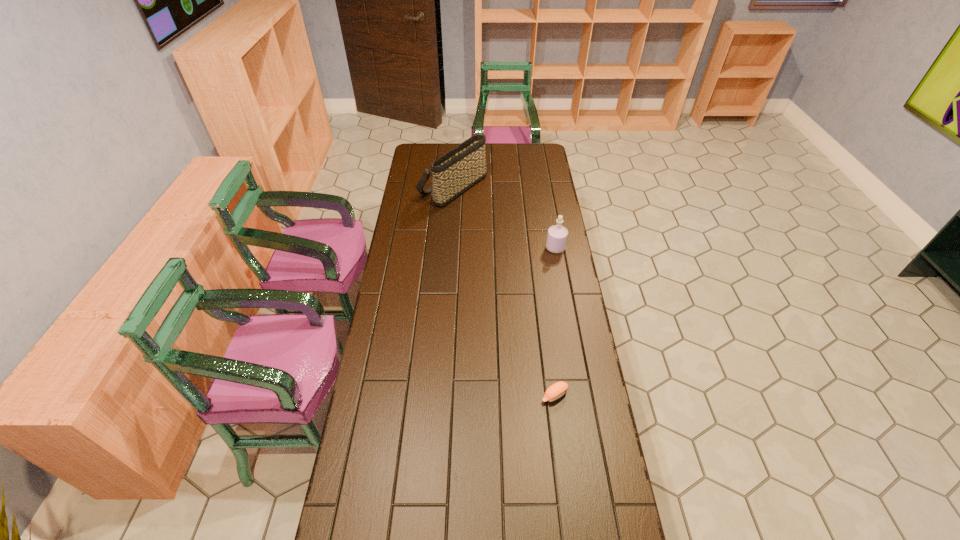
At what (x,y) coordinates should I click in order to perform the action: click on handbag. Please return your answer as a coordinate pair (x, y). The image size is (960, 540). Looking at the image, I should click on (456, 171).

Identify the location of the leftmost object. Image resolution: width=960 pixels, height=540 pixels. (456, 171).

The height and width of the screenshot is (540, 960). I want to click on the second shortest object, so click(557, 235).

What are the coordinates of `perfume` in the screenshot? It's located at (557, 235).

This screenshot has width=960, height=540. I want to click on the shortest object, so click(557, 390).

The height and width of the screenshot is (540, 960). What are the coordinates of `the second object from right to left` in the screenshot? It's located at (557, 390).

What are the coordinates of `free space located on the right of the farthest object` in the screenshot? It's located at (513, 187).

Find the location of a particular element. The height and width of the screenshot is (540, 960). free space located 0.370m on the left of the second shortest object is located at coordinates (462, 248).

The height and width of the screenshot is (540, 960). What are the coordinates of `vacant position located on the back of the shortest object` in the screenshot? It's located at (547, 335).

What are the coordinates of `object present at the left edge` in the screenshot? It's located at (456, 171).